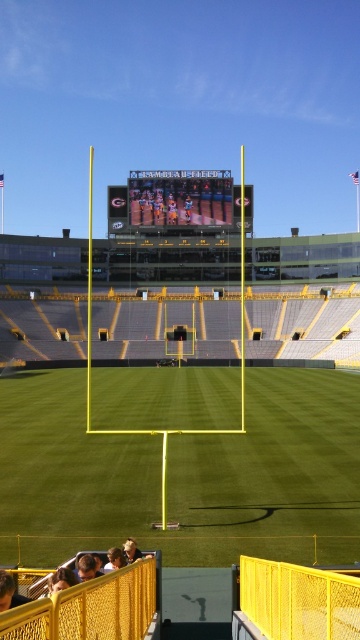
Between matte black scoreboard at center and dark brown leather jacket at lower left, which one appears on the left side from the viewer's perspective?

matte black scoreboard at center is more to the left.

Looking at this image, who is taller, matte black scoreboard at center or dark brown leather jacket at lower left?

matte black scoreboard at center is taller.

Identify the location of matte black scoreboard at center. The width and height of the screenshot is (360, 640). (180, 196).

Can you confirm if matte black scoreboard at center is smaller than blonde hair at lower center?

Incorrect, matte black scoreboard at center is not smaller in size than blonde hair at lower center.

Who is more distant from viewer, (176,193) or (102,570)?

Point (176,193)

What are the coordinates of `matte black scoreboard at center` in the screenshot? It's located at (180, 196).

Can you confirm if light brown hair at lower left is smaller than light brown wooden chair at lower center?

No.

Can you confirm if light brown hair at lower left is positioned to the left of light brown wooden chair at lower center?

Correct, you'll find light brown hair at lower left to the left of light brown wooden chair at lower center.

This screenshot has height=640, width=360. I want to click on light brown hair at lower left, so click(61, 580).